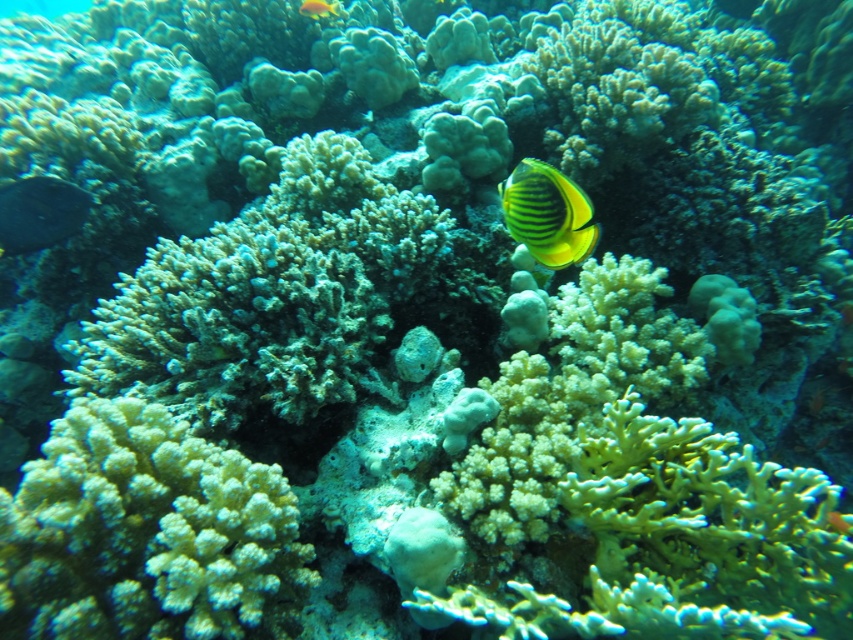
Can you confirm if yellow striped fish at center is positioned above shiny blue fish at lower left?

No, yellow striped fish at center is not above shiny blue fish at lower left.

Is point (560, 232) closer to camera compared to point (62, 225)?

Yes, point (560, 232) is closer to viewer.

Between point (563, 253) and point (13, 234), which one is positioned behind?

The point (13, 234) is behind.

Locate an element on the screen. The width and height of the screenshot is (853, 640). yellow striped fish at center is located at coordinates (547, 212).

Does white porous coral at center appear under yellow striped fish at upper center?

Indeed, white porous coral at center is positioned under yellow striped fish at upper center.

Who is taller, white porous coral at center or yellow striped fish at upper center?

Standing taller between the two is white porous coral at center.

Does point (111, 472) lie behind point (318, 1)?

No, (111, 472) is in front of (318, 1).

You are a GUI agent. You are given a task and a screenshot of the screen. Output one action in this format:
    pyautogui.click(x=<x>, y=<y>)
    Task: Click on the white porous coral at center
    
    Given the screenshot: What is the action you would take?
    pyautogui.click(x=146, y=532)

Who is positioned more to the left, yellow striped fish at center or yellow striped fish at upper center?

yellow striped fish at upper center is more to the left.

Who is more distant from viewer, (549,173) or (300,6)?

The point (300,6) is more distant.

Describe the element at coordinates (547, 212) in the screenshot. This screenshot has width=853, height=640. I see `yellow striped fish at center` at that location.

Where is `yellow striped fish at center`? The height and width of the screenshot is (640, 853). yellow striped fish at center is located at coordinates (547, 212).